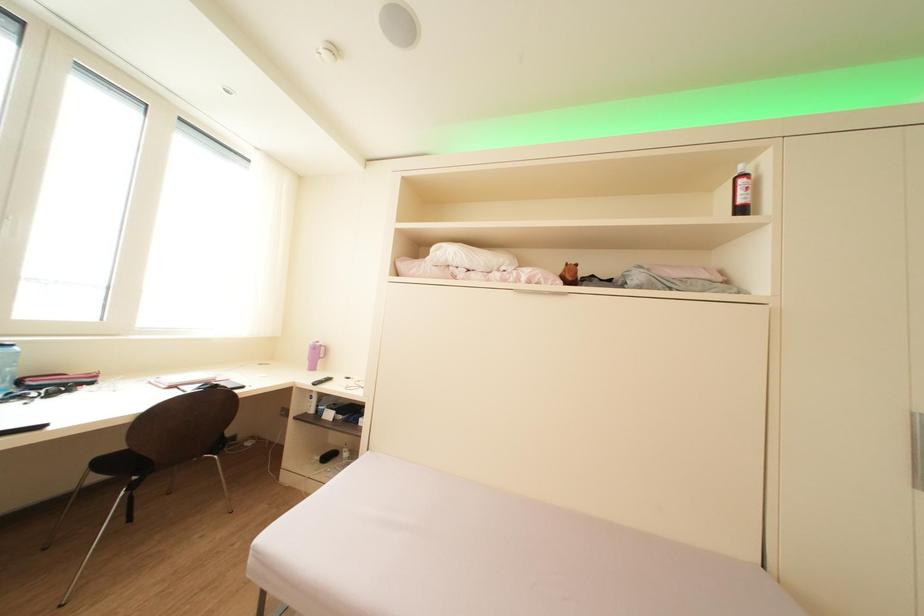
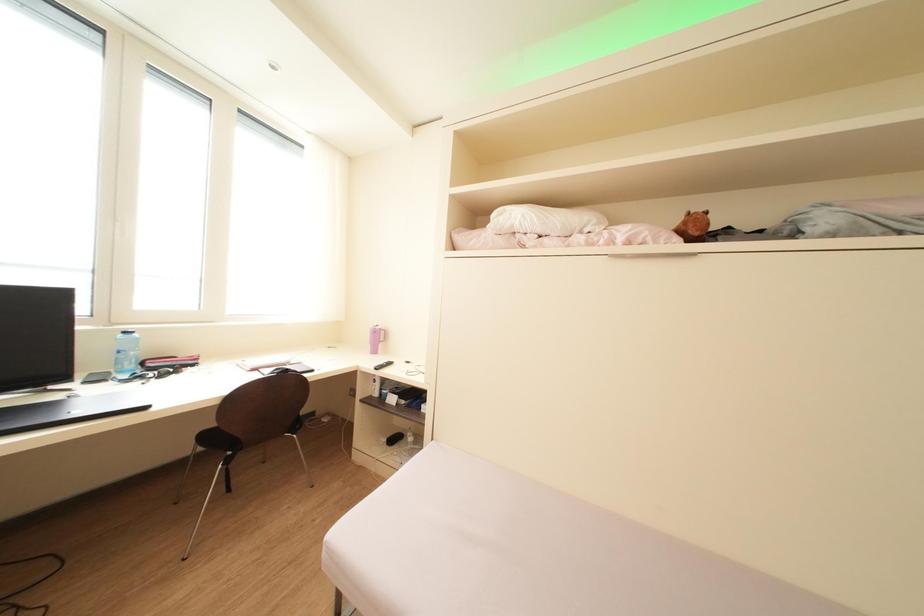
Question: The camera is either moving clockwise (left) or counter-clockwise (right) around the object. The first image is from the beginning of the video and the second image is from the end. Is the camera moving left or right when shooting the video?

Choices:
 (A) Left
 (B) Right

Answer: (B)